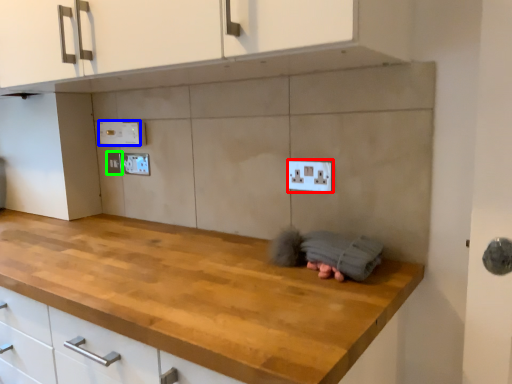
Question: Estimate the real-world distances between objects in this image. Which object is farther from electric outlet (highlighted by a red box), electric outlet (highlighted by a blue box) or electric outlet (highlighted by a green box)?

Choices:
 (A) electric outlet
 (B) electric outlet

Answer: (B)